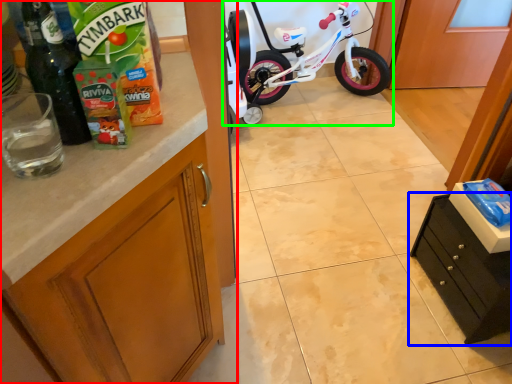
Question: Estimate the real-world distances between objects in this image. Which object is closer to cabinetry (highlighted by a red box), cabinetry (highlighted by a blue box) or bicycle (highlighted by a green box)?

Choices:
 (A) cabinetry
 (B) bicycle

Answer: (A)